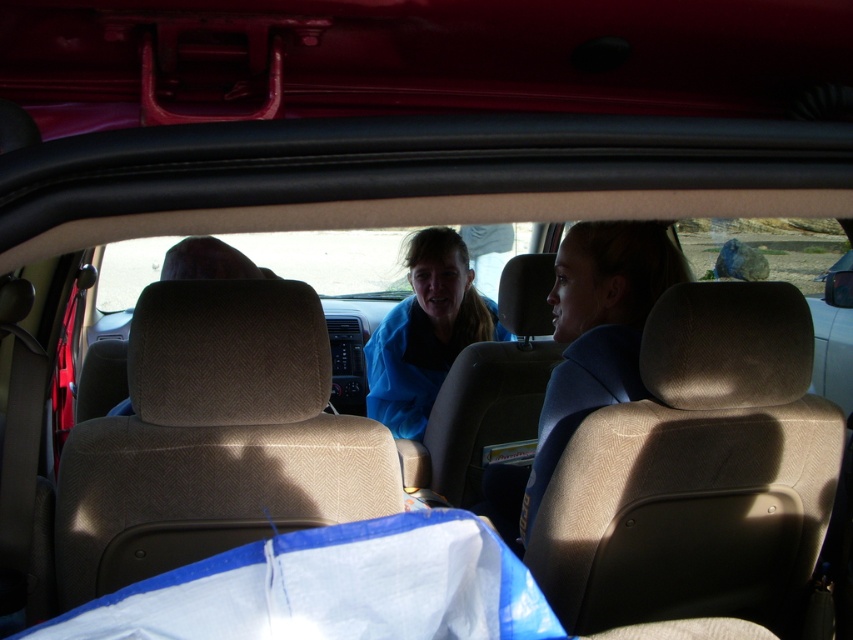
Does point (654, 262) lie behind point (503, 330)?

No, (654, 262) is closer to viewer.

Is blue fabric headrest at right positioned behind blue fabric jacket at center?

No.

Where is `blue fabric headrest at right`? Image resolution: width=853 pixels, height=640 pixels. blue fabric headrest at right is located at coordinates (596, 332).

Where is `blue fabric headrest at right`? Image resolution: width=853 pixels, height=640 pixels. blue fabric headrest at right is located at coordinates (596, 332).